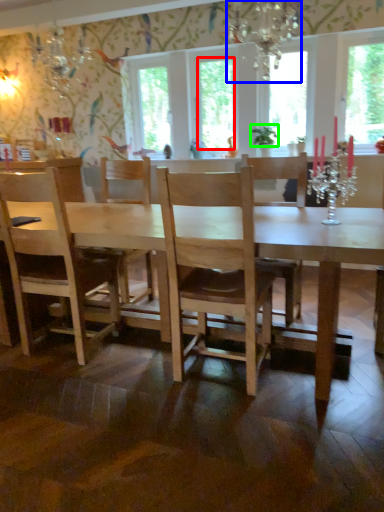
Question: Estimate the real-world distances between objects in this image. Which object is farther from window screen (highlighted by a red box), light fixture (highlighted by a blue box) or plant (highlighted by a green box)?

Choices:
 (A) light fixture
 (B) plant

Answer: (A)